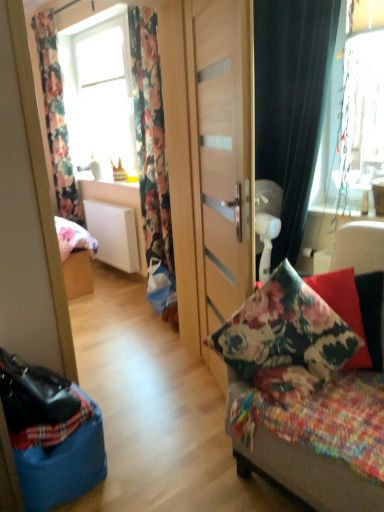
You are a GUI agent. You are given a task and a screenshot of the screen. Output one action in this format:
    pyautogui.click(x=<x>, y=<y>)
    Task: Click on the free space in front of wooden door at center
    This screenshot has width=384, height=512.
    Given the screenshot: What is the action you would take?
    pyautogui.click(x=186, y=451)